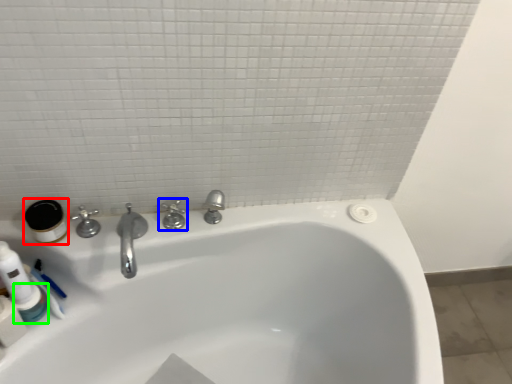
Question: Which object is positioned closest to mouthwash (highlighted by a red box)? Select from tap (highlighted by a blue box) and mouthwash (highlighted by a green box).

Choices:
 (A) tap
 (B) mouthwash

Answer: (B)